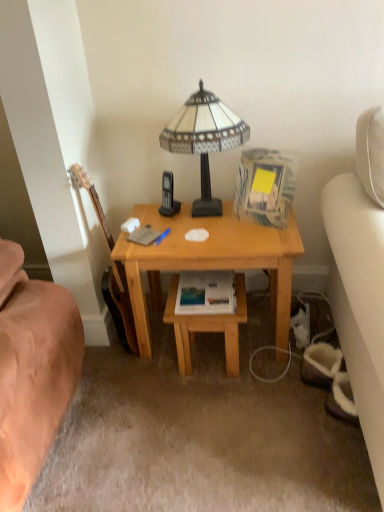
Where is `vacant area that lies between light brown wood table at center and wooden acoustic guitar at left`? vacant area that lies between light brown wood table at center and wooden acoustic guitar at left is located at coordinates (158, 352).